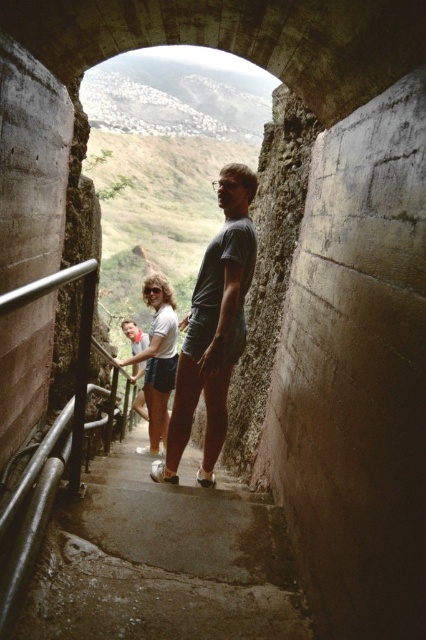
Question: Is gray cotton t-shirt at center wider than white cotton shirt at center?

Choices:
 (A) no
 (B) yes

Answer: (B)

Question: Does gray cotton t-shirt at center appear on the left side of white cotton shirt at center?

Choices:
 (A) no
 (B) yes

Answer: (A)

Question: Which object appears closest to the camera in this image?

Choices:
 (A) gray cotton t-shirt at center
 (B) white cotton shirt at center

Answer: (A)

Question: Which point is farther to the camera?

Choices:
 (A) gray cotton t-shirt at center
 (B) white cotton shirt at center

Answer: (B)

Question: Is gray cotton t-shirt at center bigger than white cotton shirt at center?

Choices:
 (A) no
 (B) yes

Answer: (B)